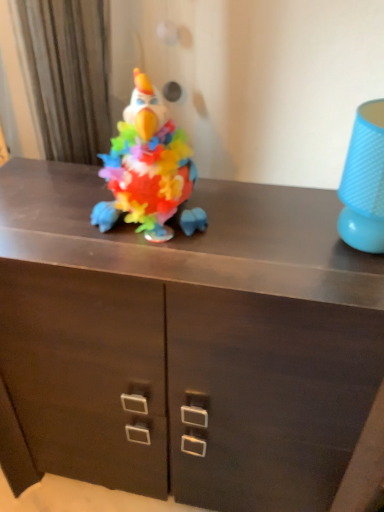
The width and height of the screenshot is (384, 512). What are the coordinates of `wooden cabinet at center` in the screenshot? It's located at (190, 341).

Is wooden cabinet at center next to plush multicolored parrot at center and touching it?

No.

In the scene shown: Considering the relative positions of wooden cabinet at center and plush multicolored parrot at center in the image provided, is wooden cabinet at center to the left or to the right of plush multicolored parrot at center?

wooden cabinet at center is to the right of plush multicolored parrot at center.

Can you confirm if wooden cabinet at center is thinner than plush multicolored parrot at center?

In fact, wooden cabinet at center might be wider than plush multicolored parrot at center.

Is plush multicolored parrot at center inside the boundaries of wooden cabinet at center, or outside?

plush multicolored parrot at center exists outside the volume of wooden cabinet at center.

Considering the relative sizes of plush multicolored parrot at center and wooden cabinet at center in the image provided, is plush multicolored parrot at center bigger than wooden cabinet at center?

Actually, plush multicolored parrot at center might be smaller than wooden cabinet at center.

Considering the sizes of objects plush multicolored parrot at center and wooden cabinet at center in the image provided, who is shorter, plush multicolored parrot at center or wooden cabinet at center?

plush multicolored parrot at center is shorter.

Between plush multicolored parrot at center and blue textured lampshade at right, which one appears on the right side from the viewer's perspective?

From the viewer's perspective, blue textured lampshade at right appears more on the right side.

How distant is plush multicolored parrot at center from blue textured lampshade at right?

plush multicolored parrot at center is 13.35 inches from blue textured lampshade at right.

Is plush multicolored parrot at center situated inside blue textured lampshade at right or outside?

The correct answer is: outside.

Is blue textured lampshade at right shorter than wooden cabinet at center?

Yes.

You are a GUI agent. You are given a task and a screenshot of the screen. Output one action in this format:
    pyautogui.click(x=<x>, y=<y>)
    Task: Click on the lamp lying above the wooden cabinet at center (from the image's perspective)
    
    Given the screenshot: What is the action you would take?
    pyautogui.click(x=364, y=181)

From the image's perspective, is blue textured lampshade at right on top of wooden cabinet at center?

Yes, from the image's perspective, blue textured lampshade at right is on top of wooden cabinet at center.

Find the location of `lamp on the right of plush multicolored parrot at center`. lamp on the right of plush multicolored parrot at center is located at coordinates (364, 181).

Is blue textured lampshade at right thinner than plush multicolored parrot at center?

Incorrect, the width of blue textured lampshade at right is not less than that of plush multicolored parrot at center.

How many degrees apart are the facing directions of blue textured lampshade at right and plush multicolored parrot at center?

There is a 3.92-degree angle between the facing directions of blue textured lampshade at right and plush multicolored parrot at center.

Would you consider blue textured lampshade at right to be distant from plush multicolored parrot at center?

No, there isn't a large distance between blue textured lampshade at right and plush multicolored parrot at center.

Is wooden cabinet at center aimed at blue textured lampshade at right?

No, wooden cabinet at center is not oriented towards blue textured lampshade at right.

Considering the positions of objects wooden cabinet at center and blue textured lampshade at right in the image provided, who is behind, wooden cabinet at center or blue textured lampshade at right?

Positioned behind is wooden cabinet at center.

Looking at their sizes, would you say wooden cabinet at center is wider or thinner than blue textured lampshade at right?

Considering their sizes, wooden cabinet at center looks broader than blue textured lampshade at right.

There is a wooden cabinet at center. Where is `toy above it (from a real-world perspective)`? Image resolution: width=384 pixels, height=512 pixels. toy above it (from a real-world perspective) is located at coordinates (146, 166).

This screenshot has width=384, height=512. Find the location of `the chest of drawers lying in front of the plush multicolored parrot at center`. the chest of drawers lying in front of the plush multicolored parrot at center is located at coordinates (190, 341).

From the image, which object appears to be nearer to blue textured lampshade at right, plush multicolored parrot at center or wooden cabinet at center?

Among the two, plush multicolored parrot at center is located nearer to blue textured lampshade at right.

Based on their spatial positions, is plush multicolored parrot at center or blue textured lampshade at right further from wooden cabinet at center?

blue textured lampshade at right.

Which object lies further to the anchor point blue textured lampshade at right, wooden cabinet at center or plush multicolored parrot at center?

wooden cabinet at center.

From the image, which object appears to be farther from plush multicolored parrot at center, blue textured lampshade at right or wooden cabinet at center?

blue textured lampshade at right.

Which object lies nearer to the anchor point plush multicolored parrot at center, wooden cabinet at center or blue textured lampshade at right?

The object closer to plush multicolored parrot at center is wooden cabinet at center.

From the image, which object appears to be nearer to wooden cabinet at center, blue textured lampshade at right or plush multicolored parrot at center?

The object closer to wooden cabinet at center is plush multicolored parrot at center.

Where is `lamp that lies between plush multicolored parrot at center and wooden cabinet at center from top to bottom`? lamp that lies between plush multicolored parrot at center and wooden cabinet at center from top to bottom is located at coordinates (364, 181).